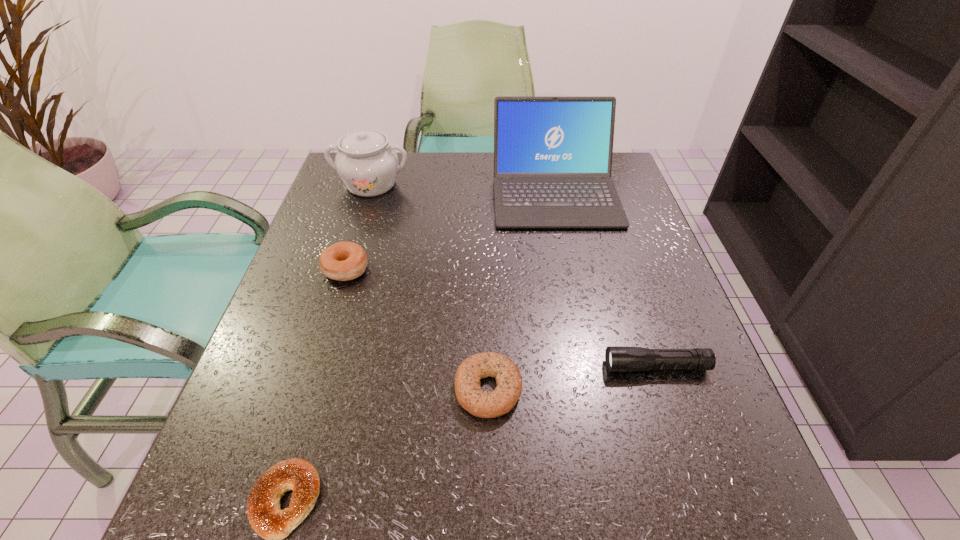
This screenshot has width=960, height=540. Find the location of `object located at the far left corner`. object located at the far left corner is located at coordinates (368, 166).

I want to click on object that is at the far right corner, so click(552, 155).

The width and height of the screenshot is (960, 540). In the image, there is a desktop. In order to click on vacant space at the far edge in this screenshot , I will do `click(433, 199)`.

Locate an element on the screen. vacant position at the left edge of the desktop is located at coordinates 300,403.

In the image, there is a desktop. Identify the location of free space at the right edge. Image resolution: width=960 pixels, height=540 pixels. (644, 225).

You are a GUI agent. You are given a task and a screenshot of the screen. Output one action in this format:
    pyautogui.click(x=<x>, y=<y>)
    Task: Click on the empty space that is in between the flashlight and the fourth nearest object
    The width and height of the screenshot is (960, 540).
    Given the screenshot: What is the action you would take?
    pyautogui.click(x=501, y=318)

The width and height of the screenshot is (960, 540). Find the location of `unoccupied area between the laptop computer and the chinaware`. unoccupied area between the laptop computer and the chinaware is located at coordinates (463, 187).

I want to click on empty space between the chinaware and the third farthest object, so click(358, 226).

This screenshot has height=540, width=960. What are the coordinates of `free spot between the rightmost bagel and the chinaware` in the screenshot? It's located at (430, 286).

You are a GUI agent. You are given a task and a screenshot of the screen. Output one action in this format:
    pyautogui.click(x=<x>, y=<y>)
    Task: Click on the unoccupied area between the second shortest bagel and the chinaware
    The width and height of the screenshot is (960, 540).
    Given the screenshot: What is the action you would take?
    pyautogui.click(x=430, y=286)